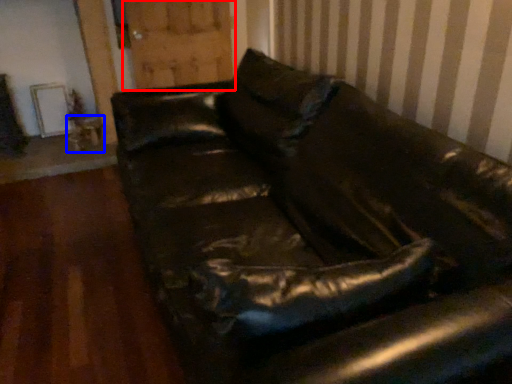
Question: Among these objects, which one is nearest to the camera, barn door (highlighted by a red box) or table (highlighted by a blue box)?

Choices:
 (A) barn door
 (B) table

Answer: (A)